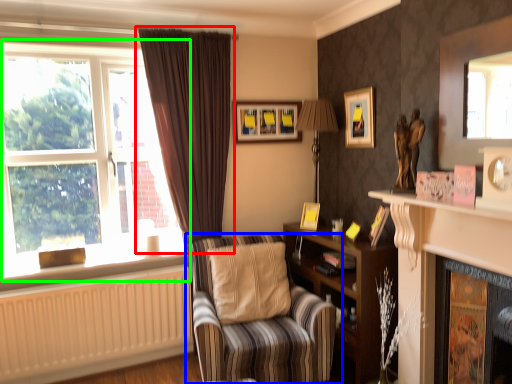
Question: Which object is positioned closest to curtain (highlighted by a red box)? Select from chair (highlighted by a blue box) and window (highlighted by a green box).

Choices:
 (A) chair
 (B) window

Answer: (B)